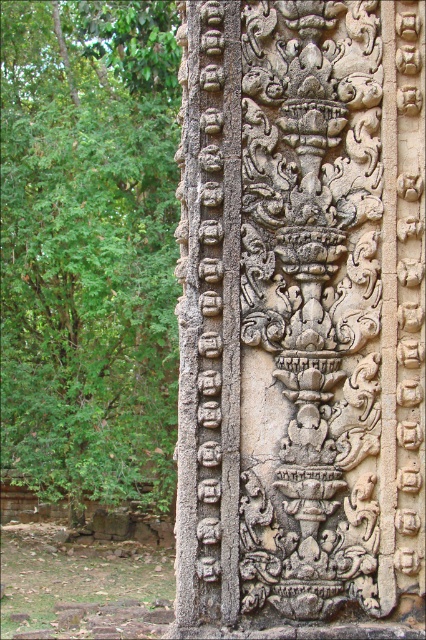
You are an archaeologist examining the carved stone structure. You notice a specific point at coordinates (301, 320). What does this point correspond to on the structure?

The point at coordinates (301, 320) corresponds to the carved stone vase at center.

You are an archaeologist examining the stone structure. You notice the carved stone vase at center and the green leafy tree at left. Which object is positioned lower in the scene?

The carved stone vase at center is positioned lower than the green leafy tree at left.

You are standing in front of the ancient stone structure and notice two points marked on the carving. The first point is at coordinates point (388, 144) and the second is at point (57, 138). Which of these two points is nearer to you as you face the structure?

Point (388, 144) is closer to the viewer than point (57, 138).